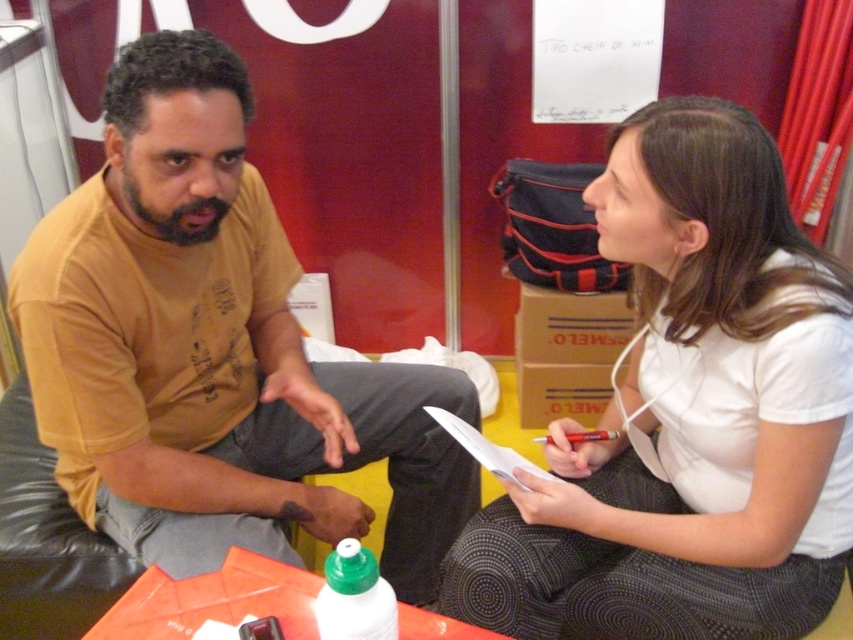
Is matte yellow t-shirt at left in front of green matte bottle at center?

No, it is not.

Is matte yellow t-shirt at left further to camera compared to green matte bottle at center?

Yes, matte yellow t-shirt at left is behind green matte bottle at center.

Find the location of a particular element. matte yellow t-shirt at left is located at coordinates (213, 349).

Looking at this image, is matte yellow t-shirt at left closer to camera compared to white matte shirt at center?

No, matte yellow t-shirt at left is further to the viewer.

Is point (428, 554) behind point (727, 348)?

Yes.

What are the coordinates of `matte yellow t-shirt at left` in the screenshot? It's located at (213, 349).

Who is positioned more to the right, white matte shirt at center or green matte bottle at center?

From the viewer's perspective, white matte shirt at center appears more on the right side.

Is white matte shirt at center smaller than green matte bottle at center?

No.

Between point (637, 573) and point (368, 577), which one is positioned in front?

Point (368, 577)

The height and width of the screenshot is (640, 853). What are the coordinates of `white matte shirt at center` in the screenshot? It's located at click(689, 416).